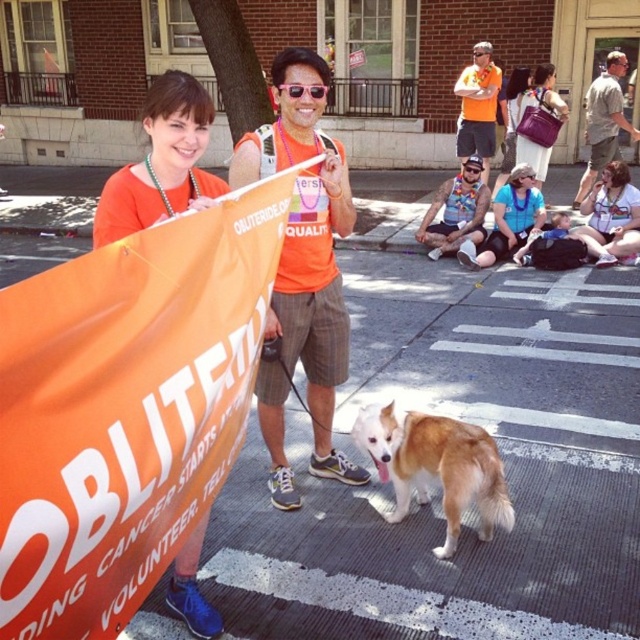
You are a photographer taking pictures of the event. You need to capture both the brown and white fur dog at center and the green fabric shirt at upper right in the same frame. Based on their positions, which direction should you move your camera to include both?

Since the brown and white fur dog at center is located below the green fabric shirt at upper right, you should move your camera upwards to include both the brown and white fur dog at center and the green fabric shirt at upper right in the same frame.

You are a photographer standing at the back of the scene. You want to capture a photo where both the orange fabric banner at center and the sunglasses at center are in focus. What is the minimum distance your camera should be set to focus at to ensure both objects are sharp?

The minimum focusing distance should be set to at least 1.61 meters to ensure both the orange fabric banner at center and the sunglasses at center are in focus since they are 1.61 meters apart.

Based on the scene description, can the sunglasses at center be fully visible when looking at the orange fabric banner at center?

The orange fabric banner at center might be wider than sunglasses at center, so there is a possibility that the sunglasses at center could be partially or fully obscured by the banner.